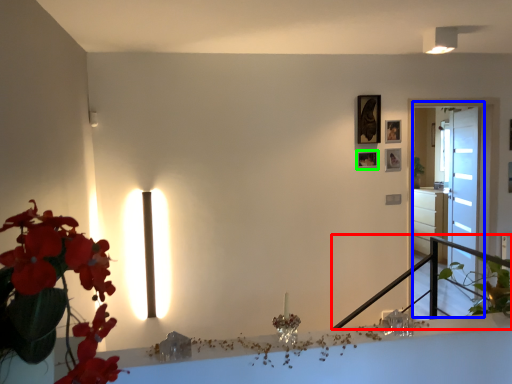
Question: Estimate the real-world distances between objects in this image. Which object is closer to balustrade (highlighted by a red box), glass door (highlighted by a blue box) or picture frame (highlighted by a green box)?

Choices:
 (A) glass door
 (B) picture frame

Answer: (A)